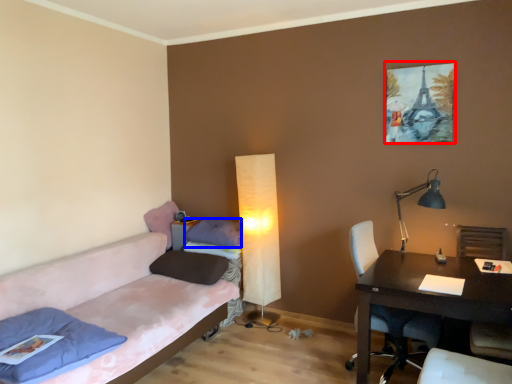
Question: Which object appears closest to the camera in this image, picture frame (highlighted by a red box) or pillow (highlighted by a blue box)?

Choices:
 (A) picture frame
 (B) pillow

Answer: (A)